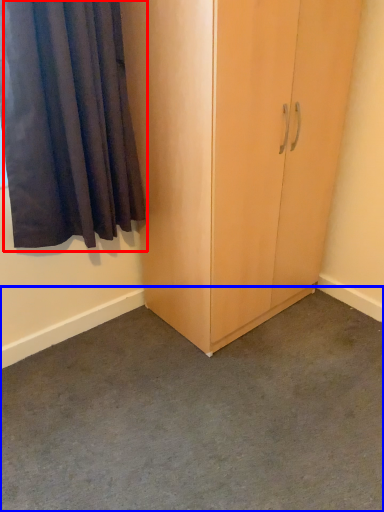
Question: Which object appears closest to the camera in this image, curtain (highlighted by a red box) or concrete (highlighted by a blue box)?

Choices:
 (A) curtain
 (B) concrete

Answer: (B)